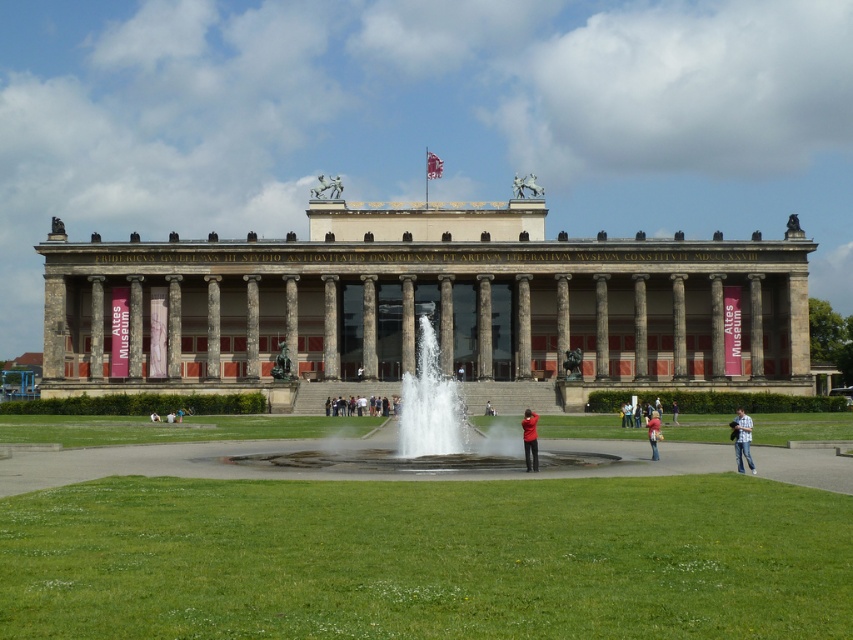
Question: Does light brown fabric people at center appear on the left side of matte black jacket at center?

Choices:
 (A) no
 (B) yes

Answer: (B)

Question: Is green grass at lower center positioned behind stone classical building at center?

Choices:
 (A) yes
 (B) no

Answer: (B)

Question: Which of these objects is positioned farthest from the red matte jacket at center?

Choices:
 (A) blurred fabric person at center
 (B) stone classical building at center

Answer: (B)

Question: Among these objects, which one is nearest to the camera?

Choices:
 (A) red matte jacket at center
 (B) green grass at lower center
 (C) matte black jacket at center

Answer: (B)

Question: Considering the relative positions of blurred fabric person at center and matte black jacket at center in the image provided, where is blurred fabric person at center located with respect to matte black jacket at center?

Choices:
 (A) right
 (B) left

Answer: (A)

Question: Which object appears farthest from the camera in this image?

Choices:
 (A) matte black jacket at center
 (B) stone classical building at center

Answer: (A)